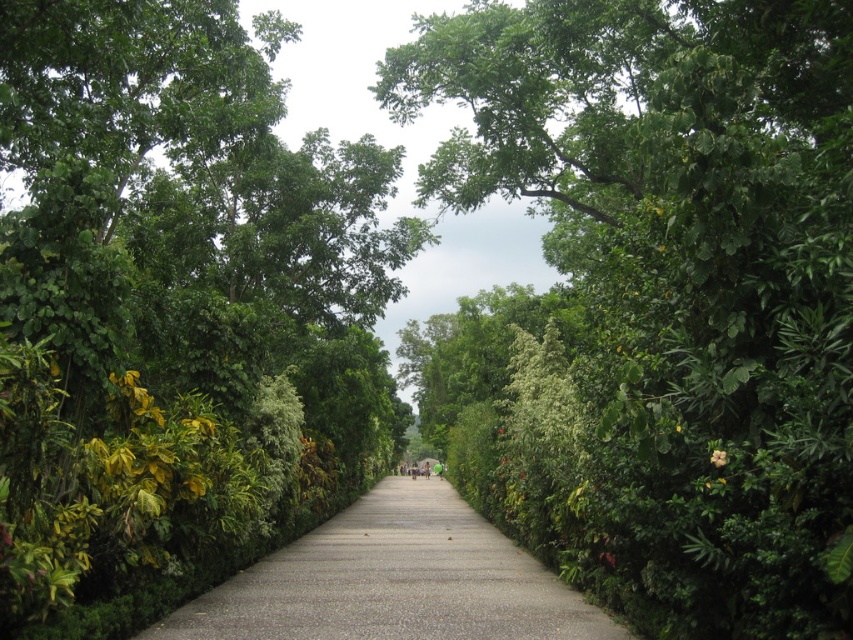
Question: Does green leafy tree at center appear under gray concrete pavement at center?

Choices:
 (A) yes
 (B) no

Answer: (B)

Question: Is green leafy tree at center positioned in front of gray concrete pavement at center?

Choices:
 (A) no
 (B) yes

Answer: (B)

Question: Is green leafy tree at center to the left of gray concrete pavement at center from the viewer's perspective?

Choices:
 (A) yes
 (B) no

Answer: (B)

Question: Among these objects, which one is nearest to the camera?

Choices:
 (A) green leafy tree at center
 (B) gray concrete pavement at center

Answer: (A)